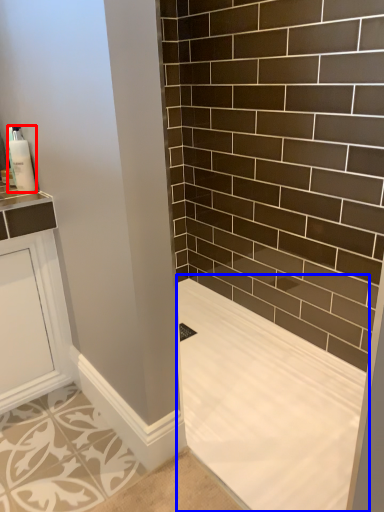
Question: Which point is further to the camera, soap dispenser (highlighted by a red box) or bath (highlighted by a blue box)?

Choices:
 (A) soap dispenser
 (B) bath

Answer: (A)